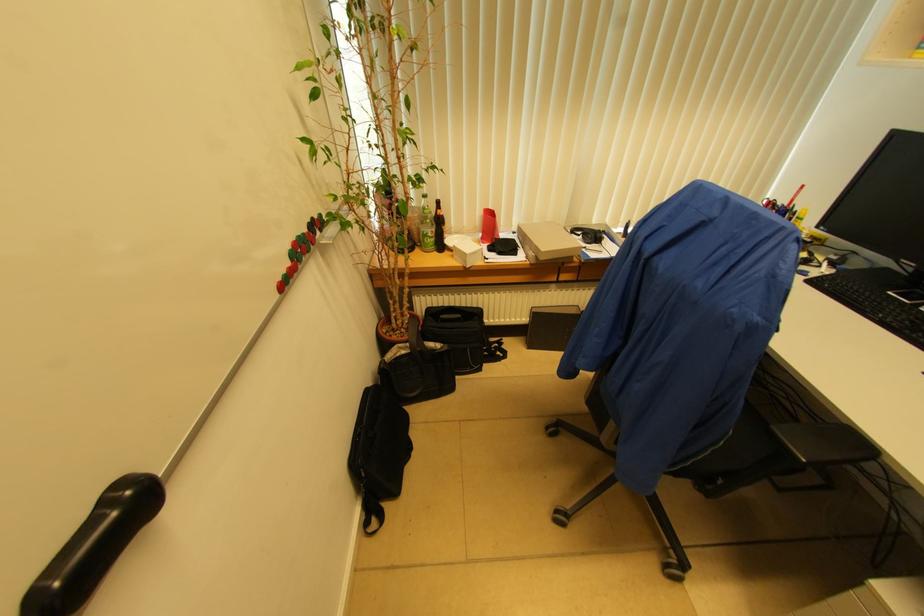
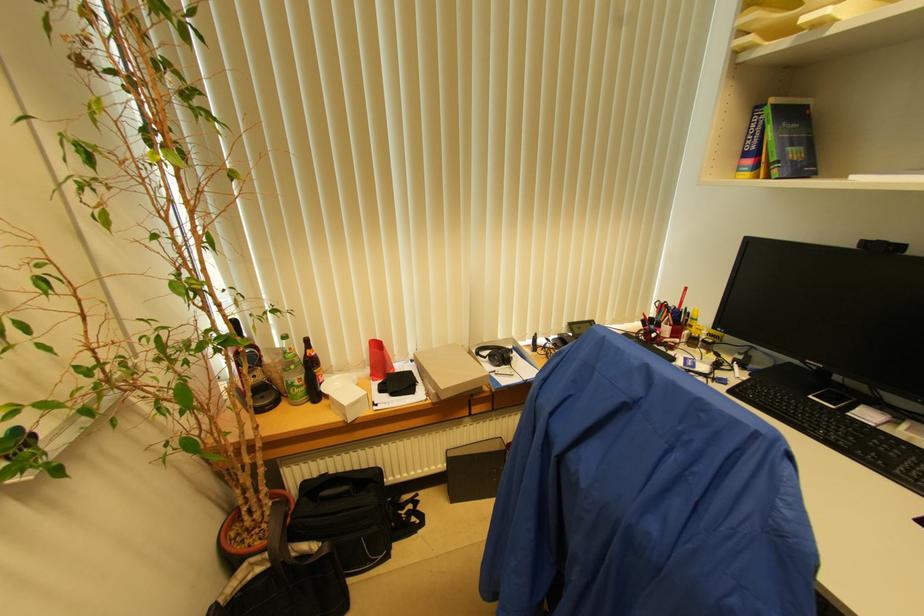
Find the pixel in the second image that matches (x=435, y=233) in the first image.

(304, 379)